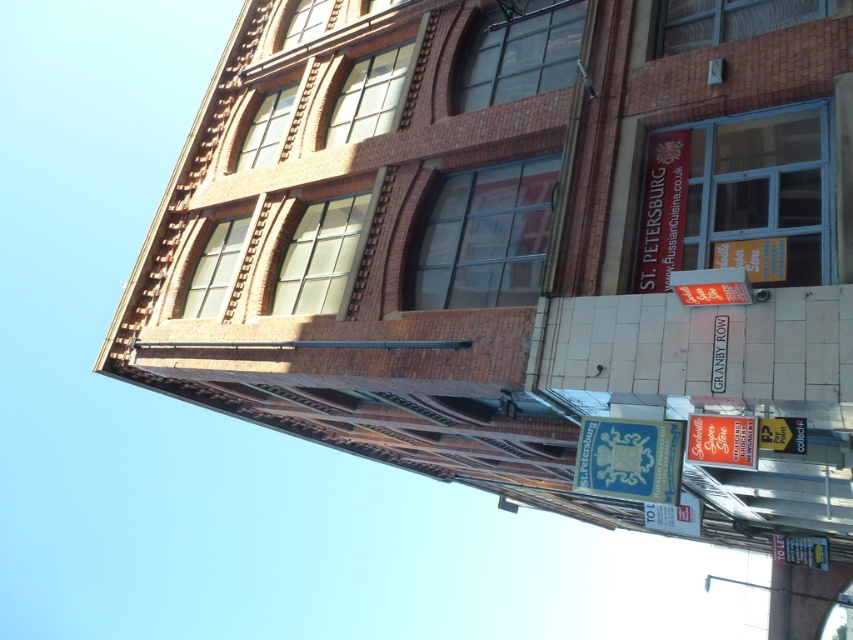
Which is below, metallic gold sign at lower right or white plastic sign at lower right?

white plastic sign at lower right is below.

Is metallic gold sign at lower right below white plastic sign at lower right?

No.

Where is `metallic gold sign at lower right`? This screenshot has width=853, height=640. metallic gold sign at lower right is located at coordinates (721, 440).

Describe the element at coordinates (630, 458) in the screenshot. Image resolution: width=853 pixels, height=640 pixels. I see `blue paper sign at lower center` at that location.

How much distance is there between blue paper sign at lower center and matte black sign at upper right?

A distance of 9.04 feet exists between blue paper sign at lower center and matte black sign at upper right.

Is point (605, 433) behind point (685, 144)?

No, (605, 433) is in front of (685, 144).

At what (x,y) coordinates should I click in order to perform the action: click on blue paper sign at lower center. Please return your answer as a coordinate pair (x, y). Looking at the image, I should click on (630, 458).

Between metallic silver sign at lower right and white plastic sign at lower right, which one has more height?

white plastic sign at lower right is taller.

Which is behind, point (798, 451) or point (798, 541)?

Positioned behind is point (798, 541).

Locate an element on the screen. The width and height of the screenshot is (853, 640). metallic silver sign at lower right is located at coordinates (782, 435).